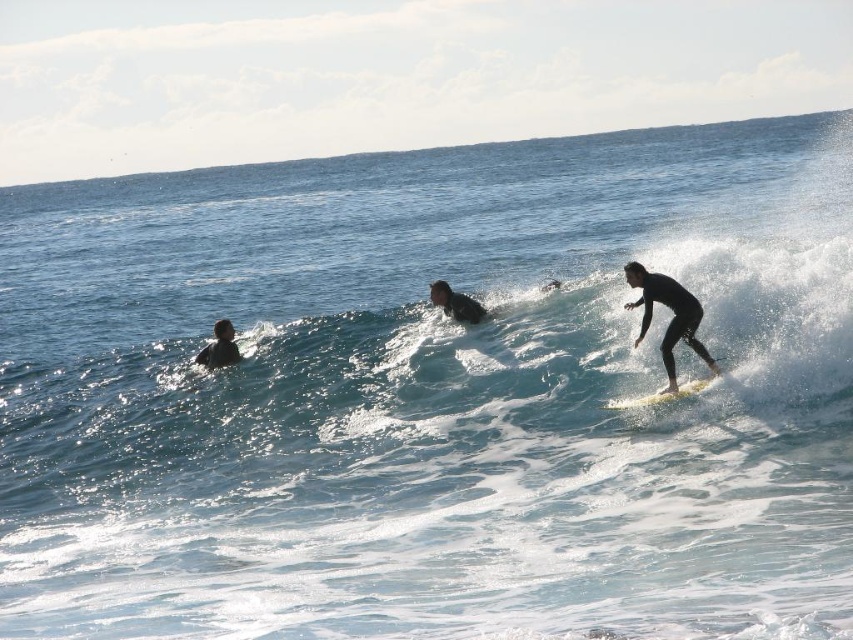
Question: Is black wetsuit surfer at center wider than white foam surfboard at right?

Choices:
 (A) no
 (B) yes

Answer: (A)

Question: Which point is farther to the camera?

Choices:
 (A) (674, 381)
 (B) (231, 360)

Answer: (B)

Question: Does black wetsuit at left appear on the right side of white foam surfboard at right?

Choices:
 (A) yes
 (B) no

Answer: (B)

Question: Which of the following is the closest to the observer?

Choices:
 (A) (463, 307)
 (B) (686, 387)
 (C) (227, 356)
 (D) (668, 352)

Answer: (B)

Question: Can you confirm if black matte wetsuit at right is positioned below white foam surfboard at right?

Choices:
 (A) yes
 (B) no

Answer: (B)

Question: Estimate the real-world distances between objects in this image. Which object is farther from the black matte wetsuit at right?

Choices:
 (A) black wetsuit at left
 (B) white foam surfboard at right

Answer: (A)